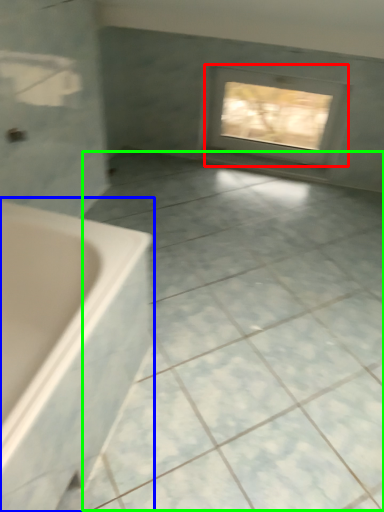
Question: Which is farther away from window (highlighted by a red box)? bathtub (highlighted by a blue box) or ceramic tile (highlighted by a green box)?

Choices:
 (A) bathtub
 (B) ceramic tile

Answer: (A)